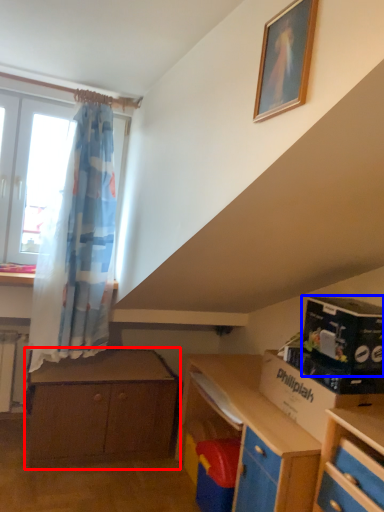
Question: Which object is further to the camera taking this photo, chest of drawers (highlighted by a red box) or box (highlighted by a blue box)?

Choices:
 (A) chest of drawers
 (B) box

Answer: (A)